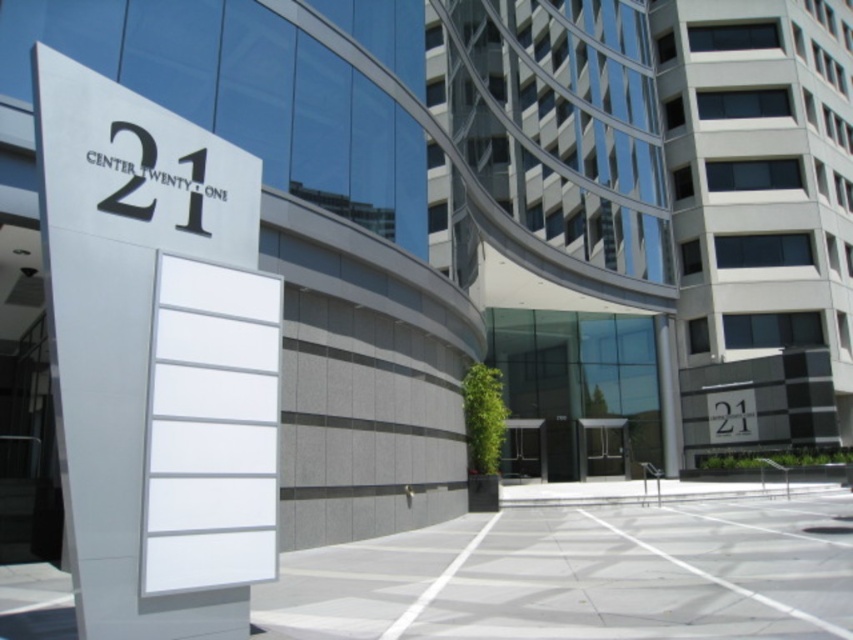
You are standing at the entrance of the building and want to locate the white glossy sign at center. According to the coordinates provided, where exactly should you look to find it?

The white glossy sign at center is located at coordinates point (138, 168), so you should look towards that position to find it.